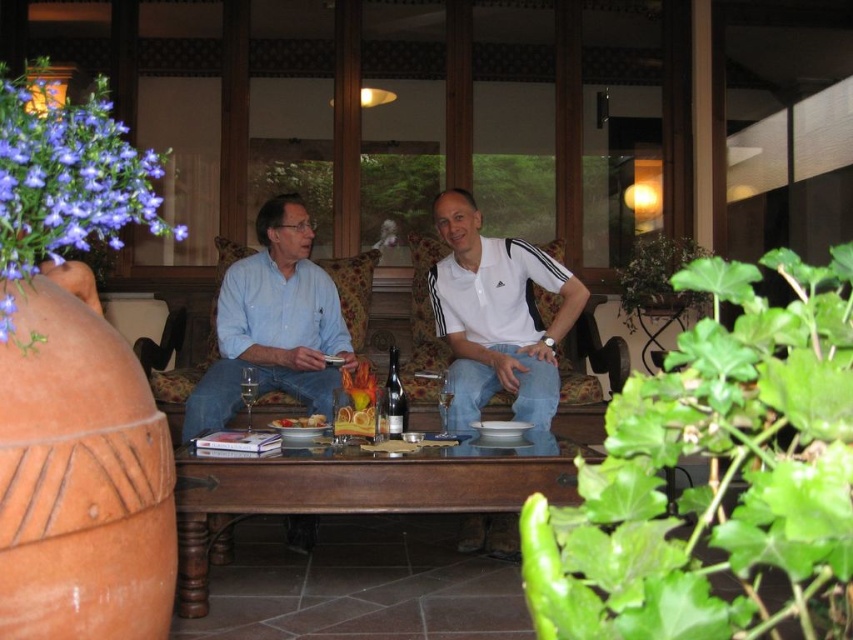
Question: Which point is farther to the camera?

Choices:
 (A) (482, 401)
 (B) (318, 417)

Answer: (A)

Question: Estimate the real-world distances between objects in this image. Which object is closer to the brown wooden table at center?

Choices:
 (A) smooth orange bowl at center
 (B) matte white shirt at center
 (C) white cotton polo shirt at center
 (D) matte blue shirt at center

Answer: (A)

Question: Can you confirm if white cotton polo shirt at center is positioned to the right of matte blue shirt at center?

Choices:
 (A) no
 (B) yes

Answer: (B)

Question: Considering the relative positions of matte white shirt at center and white cotton polo shirt at center in the image provided, where is matte white shirt at center located with respect to white cotton polo shirt at center?

Choices:
 (A) below
 (B) above

Answer: (B)

Question: Can you confirm if white cotton polo shirt at center is positioned to the left of smooth orange bowl at center?

Choices:
 (A) no
 (B) yes

Answer: (A)

Question: Which object is the closest to the matte white shirt at center?

Choices:
 (A) smooth orange bowl at center
 (B) white cotton polo shirt at center

Answer: (B)